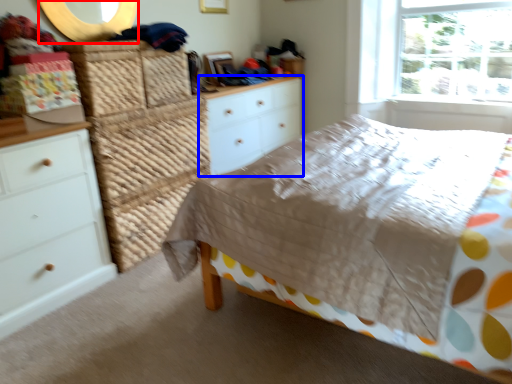
Question: Which of the following is the closest to the observer, mirror (highlighted by a red box) or chest of drawers (highlighted by a blue box)?

Choices:
 (A) mirror
 (B) chest of drawers

Answer: (A)